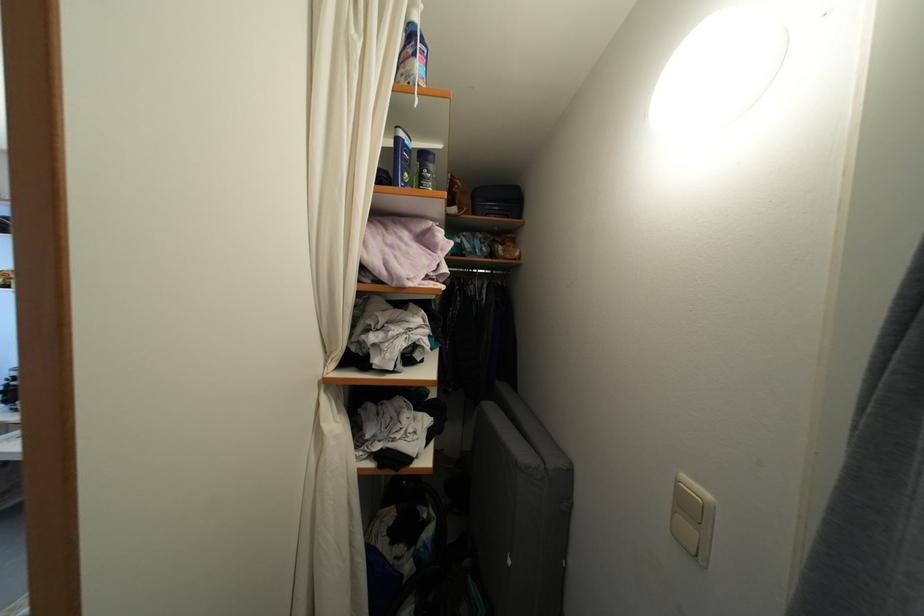
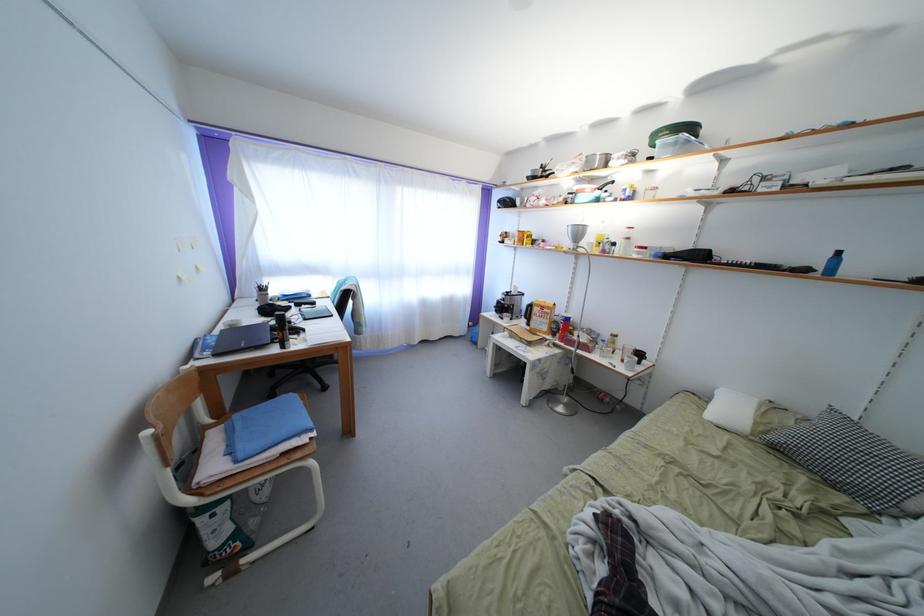
Question: How did the camera likely rotate?

Choices:
 (A) Left
 (B) Right
 (C) Up
 (D) Down

Answer: (A)